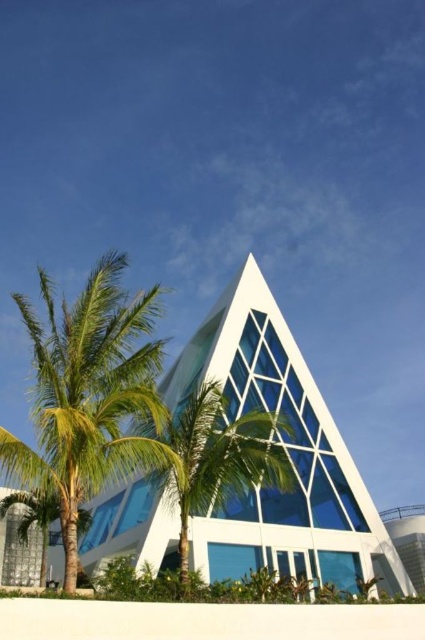
Is transparent glass chapel at center taller than green leafy palm tree at center?

Correct, transparent glass chapel at center is much taller as green leafy palm tree at center.

Is point (252, 330) positioned before point (197, 496)?

No, (252, 330) is behind (197, 496).

Which is in front, point (201, 364) or point (212, 433)?

Point (212, 433) is in front.

Where is `transparent glass chapel at center`? transparent glass chapel at center is located at coordinates (288, 452).

Does green leafy palm tree at left lie in front of green leafy palm tree at center?

That is True.

What do you see at coordinates (88, 396) in the screenshot? The width and height of the screenshot is (425, 640). I see `green leafy palm tree at left` at bounding box center [88, 396].

Locate an element on the screen. green leafy palm tree at left is located at coordinates (88, 396).

Which of these two, transparent glass chapel at center or green leafy palm tree at left, stands taller?

With more height is green leafy palm tree at left.

Is transparent glass chapel at center wider than green leafy palm tree at left?

No, transparent glass chapel at center is not wider than green leafy palm tree at left.

What do you see at coordinates (288, 452) in the screenshot? This screenshot has height=640, width=425. I see `transparent glass chapel at center` at bounding box center [288, 452].

I want to click on transparent glass chapel at center, so click(288, 452).